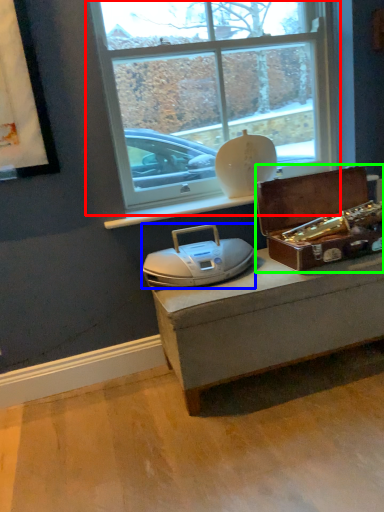
Question: Estimate the real-world distances between objects in this image. Which object is closer to window (highlighted by a red box), stereo (highlighted by a blue box) or box (highlighted by a green box)?

Choices:
 (A) stereo
 (B) box

Answer: (B)